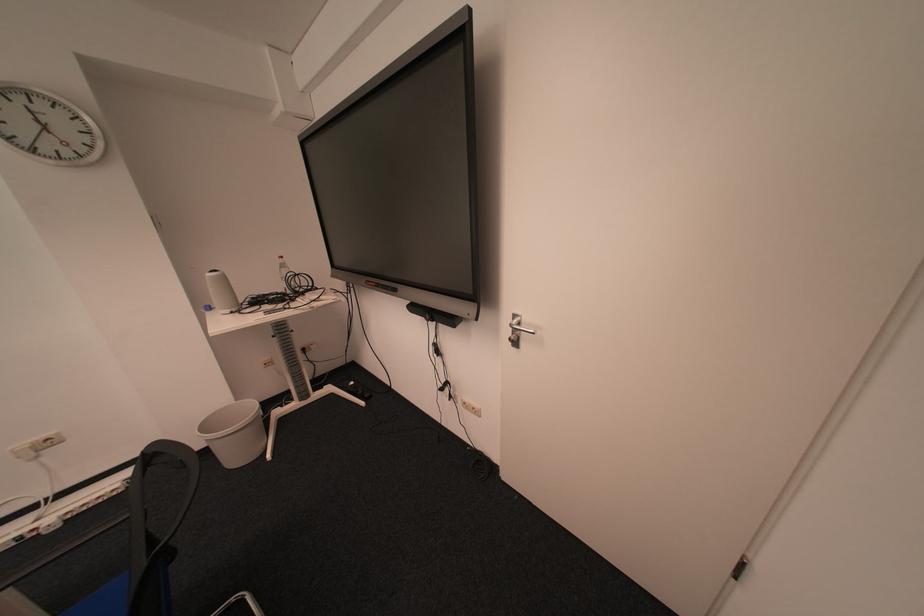
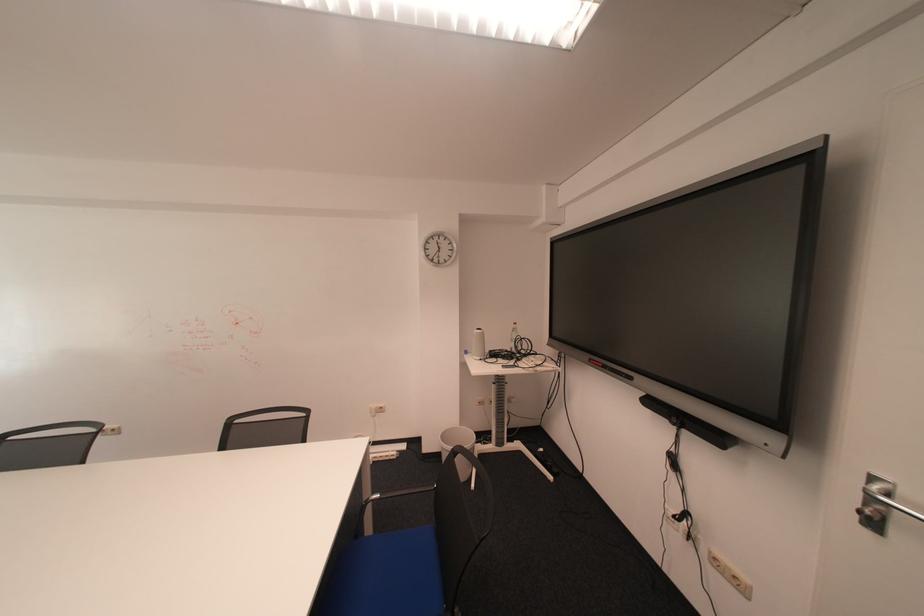
Find the pixel in the second image that matches pixel 219 313 in the first image.

(477, 355)